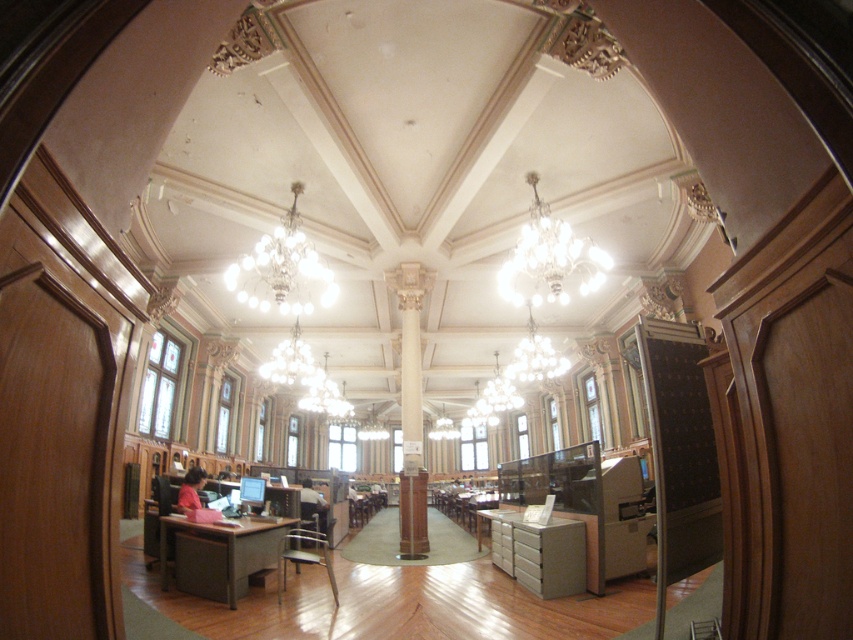
Question: Does clear glass chandelier at center come in front of silver metallic chandelier at upper center?

Choices:
 (A) no
 (B) yes

Answer: (B)

Question: Does clear glass chandelier at center appear under white glass chandelier at center?

Choices:
 (A) yes
 (B) no

Answer: (B)

Question: Is silver metallic chandelier at upper center closer to the viewer compared to matte gold chandelier at center?

Choices:
 (A) yes
 (B) no

Answer: (A)

Question: Which of these objects is positioned closest to the white glass chandelier at center?

Choices:
 (A) silver metallic chandelier at upper center
 (B) clear glass chandelier at center

Answer: (A)

Question: Among these objects, which one is nearest to the camera?

Choices:
 (A) matte gold chandelier at center
 (B) silver metallic chandelier at upper center

Answer: (B)

Question: Which is nearer to the clear glass chandelier at center?

Choices:
 (A) white glass chandelier at center
 (B) silver metallic chandelier at upper center
 (C) matte gold chandelier at center

Answer: (B)